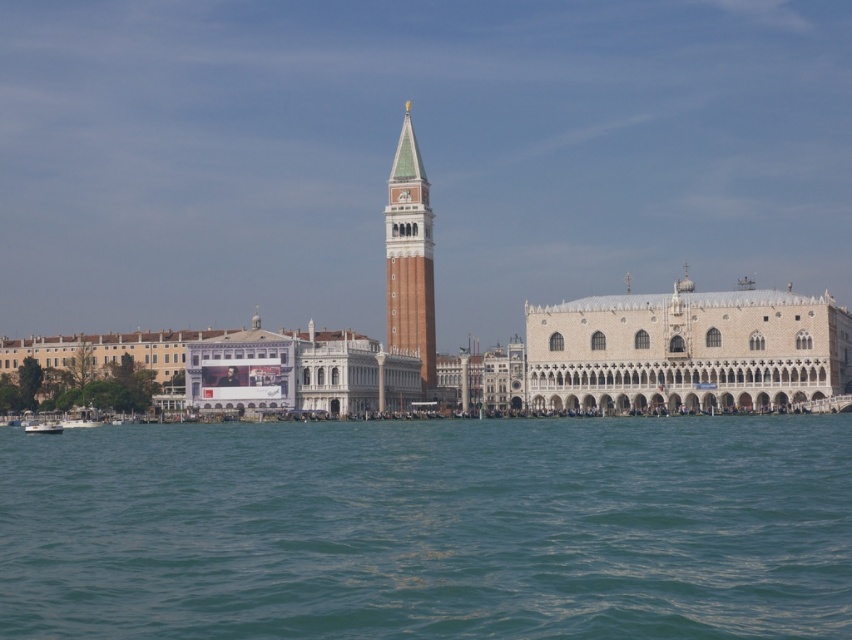
You are a tourist in Venice and want to take a photo of the white glossy boat at lower left and the teal water at lower center. Which one should you focus on if you want to capture the wider subject?

The teal water at lower center should be focused on because its width surpasses that of the white glossy boat at lower left.

You are standing on a boat in the water and want to know the distance between the brick tower at center and the Doge Palace. Can you estimate how far apart they are?

The brick tower at center and the Doge Palace are 464.18 feet apart.

You are a tourist standing on the dock and looking at the teal water at lower center and the white glossy boat at lower left. Which object appears taller from your perspective?

The teal water at lower center appears taller than the white glossy boat at lower left from your perspective.